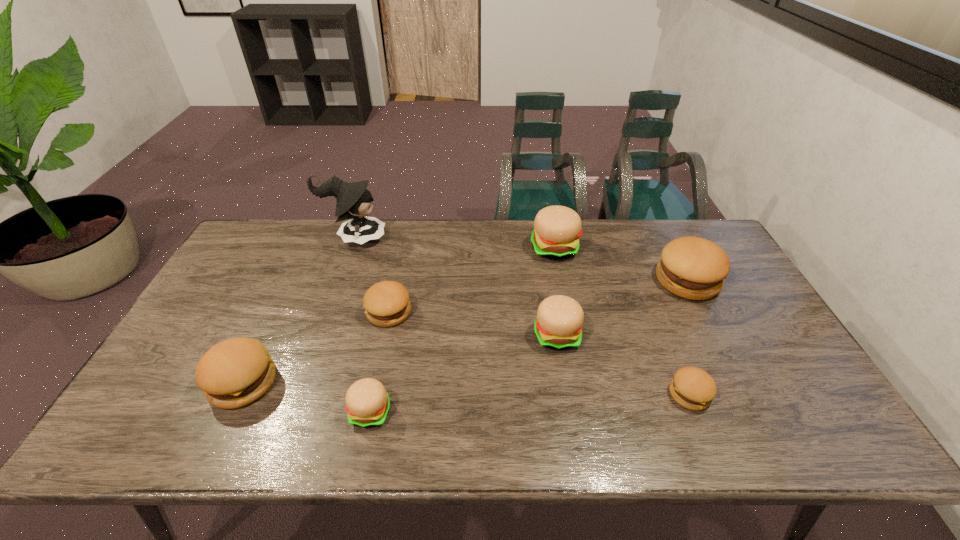
Find the location of a particular element. This screenshot has height=540, width=960. object that is at the near edge is located at coordinates (367, 403).

Where is `object that is positioned at the left edge`? The width and height of the screenshot is (960, 540). object that is positioned at the left edge is located at coordinates (236, 372).

Identify the location of object that is positioned at the right edge. This screenshot has width=960, height=540. pyautogui.click(x=693, y=268).

The height and width of the screenshot is (540, 960). I want to click on object that is at the far right corner, so click(x=693, y=268).

This screenshot has height=540, width=960. I want to click on free point at the far edge, so click(x=526, y=256).

Where is `free region at the near edge of the desktop`? The width and height of the screenshot is (960, 540). free region at the near edge of the desktop is located at coordinates (448, 442).

Find the location of `vacant area at the left edge of the desktop`. vacant area at the left edge of the desktop is located at coordinates (229, 320).

The image size is (960, 540). Identify the location of blank region between the leftmost brown hamburger and the second smallest beige hamburger. (400, 359).

This screenshot has width=960, height=540. What are the coordinates of `empty space between the second brown hamburger from left to right and the second farthest beige hamburger` in the screenshot? It's located at (473, 323).

Locate an element on the screen. free spot between the smallest beige hamburger and the doll is located at coordinates (362, 325).